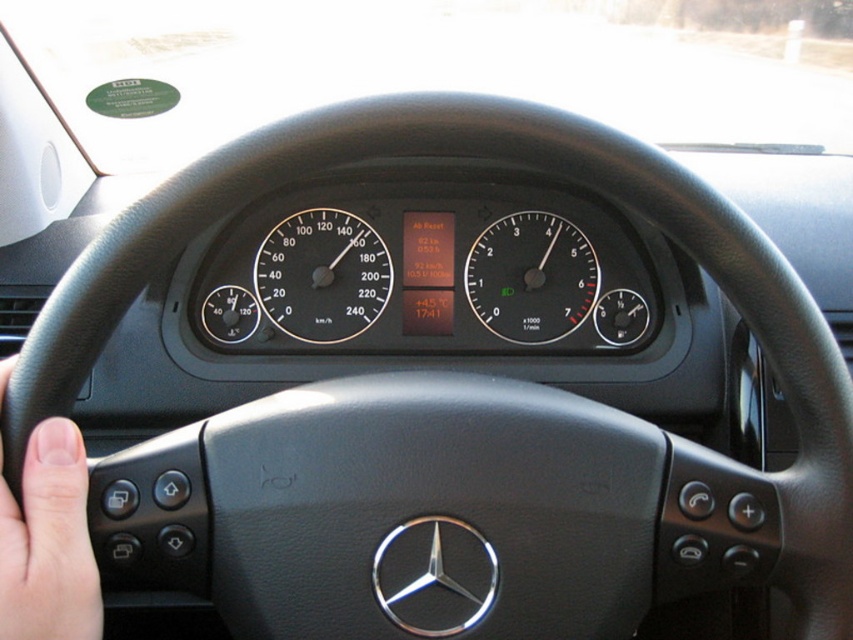
Question: Can you confirm if light skin/soft touch finger at center is positioned below black glass speedometer at center?

Choices:
 (A) no
 (B) yes

Answer: (B)

Question: Which point is farther from the camera taking this photo?

Choices:
 (A) (345, 326)
 (B) (486, 305)
 (C) (33, 576)

Answer: (B)

Question: Which point is closer to the camera?

Choices:
 (A) (567, 225)
 (B) (79, 618)

Answer: (B)

Question: Is light skin/soft touch finger at center below black plastic speedometer at center?

Choices:
 (A) yes
 (B) no

Answer: (A)

Question: Can you confirm if light skin/soft touch finger at center is positioned below black glass speedometer at center?

Choices:
 (A) no
 (B) yes

Answer: (B)

Question: Estimate the real-world distances between objects in this image. Which object is farther from the light skin/soft touch finger at center?

Choices:
 (A) black glass speedometer at center
 (B) black plastic speedometer at center

Answer: (A)